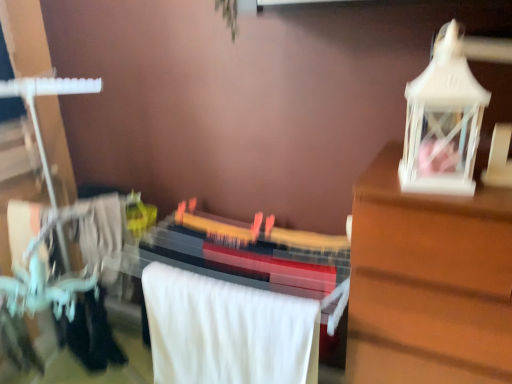
Question: From a real-world perspective, is matte black guitar at center physically located above or below black fabric at lower left?

Choices:
 (A) above
 (B) below

Answer: (B)

Question: Looking at the image, does matte black guitar at center seem bigger or smaller compared to black fabric at lower left?

Choices:
 (A) big
 (B) small

Answer: (A)

Question: Based on their relative distances, which object is farther from the black fabric at lower left?

Choices:
 (A) white plastic lantern at upper right
 (B) white soft towel at center
 (C) matte black guitar at center

Answer: (A)

Question: Which object is the closest to the white soft towel at center?

Choices:
 (A) black fabric at lower left
 (B) matte black guitar at center
 (C) white plastic lantern at upper right

Answer: (B)